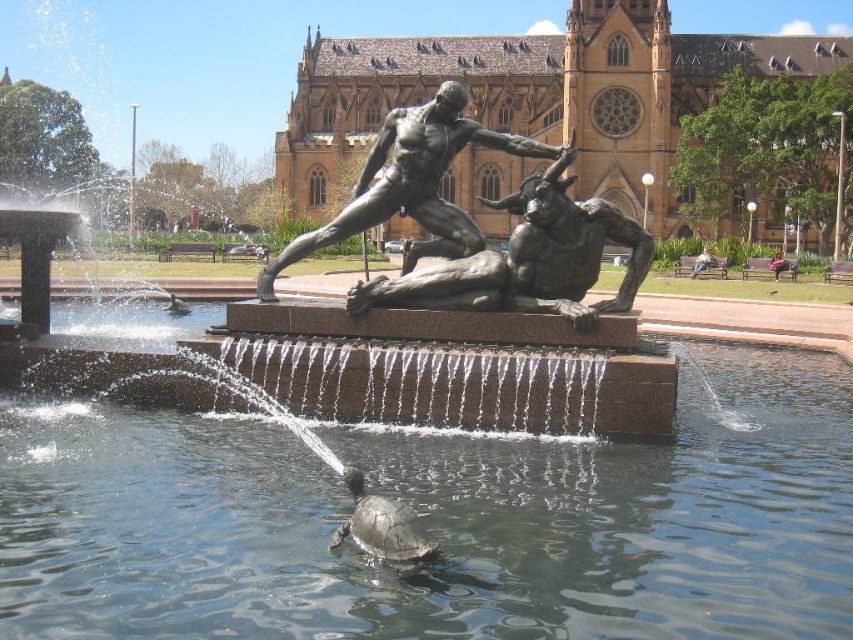
Who is higher up, clear water at fountain center or shiny dark green tortoise at center?

shiny dark green tortoise at center is above.

Can you confirm if clear water at fountain center is smaller than shiny dark green tortoise at center?

Actually, clear water at fountain center might be larger than shiny dark green tortoise at center.

Locate an element on the screen. The image size is (853, 640). clear water at fountain center is located at coordinates (439, 518).

Where is `clear water at fountain center`? clear water at fountain center is located at coordinates (439, 518).

From the picture: Is clear water at fountain center positioned in front of bronze statue at center?

That is True.

What do you see at coordinates (439, 518) in the screenshot? I see `clear water at fountain center` at bounding box center [439, 518].

Is point (730, 381) less distant than point (544, 225)?

No, it is behind (544, 225).

Locate an element on the screen. clear water at fountain center is located at coordinates (439, 518).

Consider the image. Is light brown wooden bench at center right bigger than shiny dark green tortoise at center?

No.

You are a GUI agent. You are given a task and a screenshot of the screen. Output one action in this format:
    pyautogui.click(x=<x>, y=<y>)
    Task: Click on the light brown wooden bench at center right
    This screenshot has width=853, height=640.
    Given the screenshot: What is the action you would take?
    pyautogui.click(x=780, y=264)